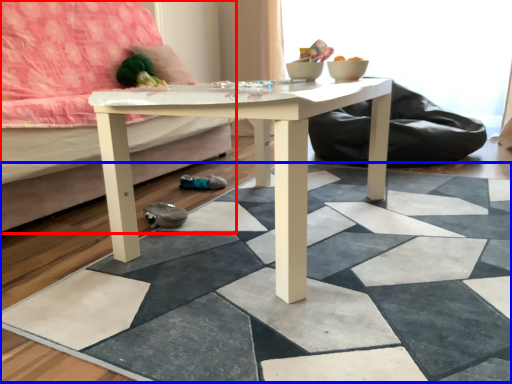
Question: Which object appears closest to the camera in this image, studio couch (highlighted by a red box) or tile (highlighted by a blue box)?

Choices:
 (A) studio couch
 (B) tile

Answer: (B)